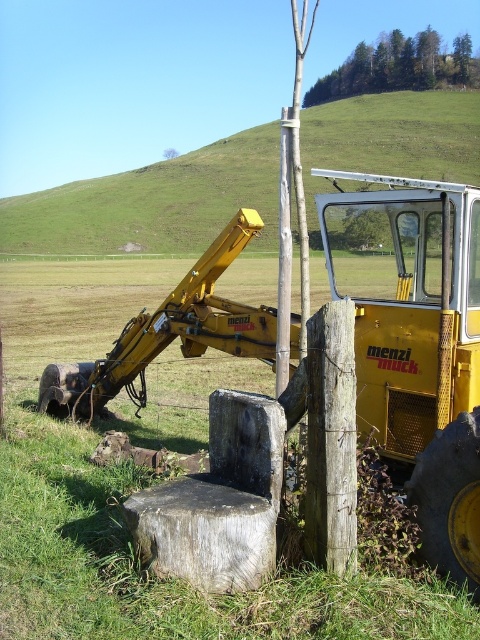
Identify the location of yellow rubber tractor at center. The height and width of the screenshot is (640, 480). (416, 342).

Who is taller, yellow rubber tractor at center or green leafy tree at upper center?

Standing taller between the two is green leafy tree at upper center.

Between point (247, 221) and point (357, 72), which one is positioned behind?

The point (357, 72) is behind.

Where is `yellow rubber tractor at center`? The height and width of the screenshot is (640, 480). yellow rubber tractor at center is located at coordinates (416, 342).